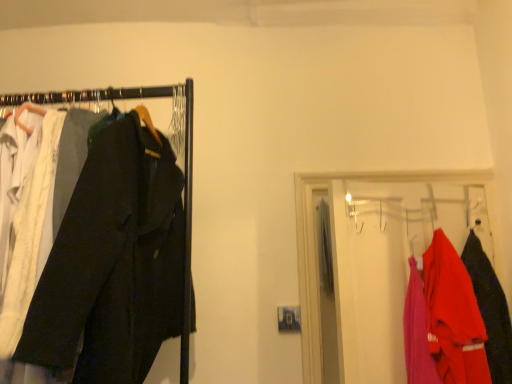
Question: Is dark gray cotton trousers at left outside matte red jacket at right, the 1th clothing from the left?

Choices:
 (A) no
 (B) yes

Answer: (B)

Question: From a real-world perspective, is dark gray cotton trousers at left positioned over matte red jacket at right, the 1th clothing from the left, based on gravity?

Choices:
 (A) yes
 (B) no

Answer: (A)

Question: Is the depth of dark gray cotton trousers at left greater than that of matte red jacket at right, placed as the 2th clothing when sorted from right to left?

Choices:
 (A) yes
 (B) no

Answer: (B)

Question: Considering the relative sizes of dark gray cotton trousers at left and matte red jacket at right, placed as the 2th clothing when sorted from right to left, in the image provided, is dark gray cotton trousers at left smaller than matte red jacket at right, placed as the 2th clothing when sorted from right to left,?

Choices:
 (A) no
 (B) yes

Answer: (A)

Question: Considering the relative sizes of dark gray cotton trousers at left and matte red jacket at right, the 1th clothing from the left, in the image provided, is dark gray cotton trousers at left taller than matte red jacket at right, the 1th clothing from the left,?

Choices:
 (A) no
 (B) yes

Answer: (B)

Question: Is dark gray cotton trousers at left to the right of matte red jacket at right, placed as the 2th clothing when sorted from right to left, from the viewer's perspective?

Choices:
 (A) no
 (B) yes

Answer: (A)

Question: Is matte red jacket at right, the 1th clothing when ordered from right to left, positioned far away from matte red jacket at right?

Choices:
 (A) yes
 (B) no

Answer: (B)

Question: Can you confirm if matte red jacket at right, which appears as the 2th clothing when viewed from the left, is taller than matte red jacket at right?

Choices:
 (A) no
 (B) yes

Answer: (A)

Question: Does matte red jacket at right, the 1th clothing when ordered from right to left, have a greater width compared to matte red jacket at right?

Choices:
 (A) no
 (B) yes

Answer: (B)

Question: Is matte red jacket at right, which appears as the 2th clothing when viewed from the left, completely or partially outside of matte red jacket at right?

Choices:
 (A) yes
 (B) no

Answer: (B)

Question: From a real-world perspective, is matte red jacket at right, which appears as the 2th clothing when viewed from the left, under matte red jacket at right?

Choices:
 (A) yes
 (B) no

Answer: (A)

Question: Is matte red jacket at right, which appears as the 2th clothing when viewed from the left, positioned before matte red jacket at right?

Choices:
 (A) no
 (B) yes

Answer: (A)

Question: Is matte red jacket at right, the 1th clothing from the left, positioned beyond the bounds of matte red jacket at right?

Choices:
 (A) no
 (B) yes

Answer: (A)